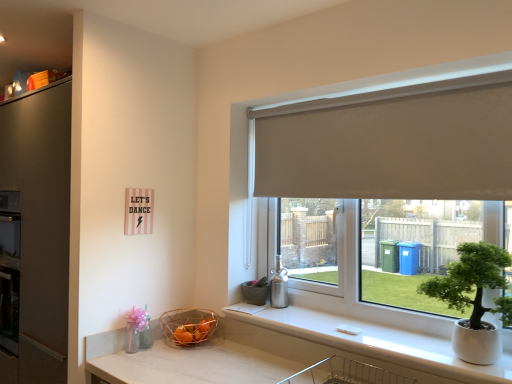
Question: From the image's perspective, is white glossy counter top at lower right on top of copper wire basket at lower center?

Choices:
 (A) no
 (B) yes

Answer: (B)

Question: Is copper wire basket at lower center inside white glossy counter top at lower right?

Choices:
 (A) no
 (B) yes

Answer: (A)

Question: Is white glossy counter top at lower right not within copper wire basket at lower center?

Choices:
 (A) no
 (B) yes

Answer: (B)

Question: Does white glossy counter top at lower right have a lesser width compared to copper wire basket at lower center?

Choices:
 (A) no
 (B) yes

Answer: (A)

Question: Does white glossy counter top at lower right have a smaller size compared to copper wire basket at lower center?

Choices:
 (A) no
 (B) yes

Answer: (A)

Question: From a real-world perspective, is white glossy counter top at lower right physically below copper wire basket at lower center?

Choices:
 (A) no
 (B) yes

Answer: (A)

Question: Could you tell me if green matte houseplant at right is turned towards matte gray flowerpot at window?

Choices:
 (A) no
 (B) yes

Answer: (A)

Question: Considering the relative sizes of green matte houseplant at right and matte gray flowerpot at window in the image provided, is green matte houseplant at right smaller than matte gray flowerpot at window?

Choices:
 (A) yes
 (B) no

Answer: (B)

Question: Is green matte houseplant at right thinner than matte gray flowerpot at window?

Choices:
 (A) yes
 (B) no

Answer: (B)

Question: Is matte gray flowerpot at window at the back of green matte houseplant at right?

Choices:
 (A) no
 (B) yes

Answer: (A)

Question: From a real-world perspective, is green matte houseplant at right beneath matte gray flowerpot at window?

Choices:
 (A) yes
 (B) no

Answer: (B)

Question: Is green matte houseplant at right bigger than matte gray flowerpot at window?

Choices:
 (A) yes
 (B) no

Answer: (A)

Question: From the image's perspective, is white glossy counter top at lower right beneath white fabric roller blind at upper center?

Choices:
 (A) no
 (B) yes

Answer: (B)